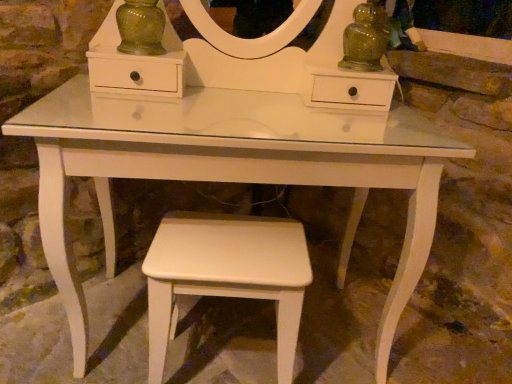
The image size is (512, 384). What do you see at coordinates (226, 274) in the screenshot? I see `white matte stool at lower center` at bounding box center [226, 274].

Measure the distance between point (283, 247) and camera.

The distance of point (283, 247) from camera is 1.08 meters.

Where is `white matte stool at lower center`? white matte stool at lower center is located at coordinates (226, 274).

Locate an element on the screen. green glass vase at upper left is located at coordinates (141, 28).

Describe the element at coordinates (141, 28) in the screenshot. The width and height of the screenshot is (512, 384). I see `green glass vase at upper left` at that location.

You are a GUI agent. You are given a task and a screenshot of the screen. Output one action in this format:
    pyautogui.click(x=<x>, y=<y>)
    Task: Click on the white matte stool at lower center
    
    Given the screenshot: What is the action you would take?
    pyautogui.click(x=226, y=274)

Between white matte stool at lower center and green glass vase at upper left, which one appears on the right side from the viewer's perspective?

white matte stool at lower center.

Does white matte stool at lower center come in front of green glass vase at upper left?

Yes, white matte stool at lower center is in front of green glass vase at upper left.

Does point (242, 250) come closer to viewer compared to point (126, 6)?

That is True.

From the image's perspective, between white matte stool at lower center and green glass vase at upper left, which one is located above?

green glass vase at upper left, from the image's perspective.

From a real-world perspective, is white matte stool at lower center above or below green glass vase at upper left?

From a real-world perspective, white matte stool at lower center is physically below green glass vase at upper left.

Does white matte stool at lower center have a greater width compared to green glass vase at upper left?

Yes.

Is white matte stool at lower center taller than green glass vase at upper left?

Yes, white matte stool at lower center is taller than green glass vase at upper left.

Looking at the image, does white matte stool at lower center seem bigger or smaller compared to green glass vase at upper left?

In the image, white matte stool at lower center appears to be larger than green glass vase at upper left.

Which is correct: white matte stool at lower center is inside green glass vase at upper left, or outside of it?

white matte stool at lower center is not enclosed by green glass vase at upper left.

Is white matte stool at lower center directly adjacent to green glass vase at upper left?

white matte stool at lower center and green glass vase at upper left are clearly separated.

Is white matte stool at lower center positioned with its back to green glass vase at upper left?

No, white matte stool at lower center is not facing away from green glass vase at upper left.

How many degrees apart are the facing directions of white matte stool at lower center and green glass vase at upper left?

white matte stool at lower center and green glass vase at upper left are facing 3.27 degrees away from each other.

In the image, there is a green glass vase at upper left. What are the coordinates of `stool below it (from a real-world perspective)` in the screenshot? It's located at (226, 274).

Which is more to the right, green glass vase at upper left or white matte stool at lower center?

white matte stool at lower center is more to the right.

Which object is further away from the camera, green glass vase at upper left or white matte stool at lower center?

green glass vase at upper left is further from the camera.

Considering the positions of point (159, 15) and point (294, 288), is point (159, 15) closer or farther from the camera than point (294, 288)?

Point (159, 15) is positioned farther from the camera compared to point (294, 288).

From the image's perspective, which object appears higher, green glass vase at upper left or white matte stool at lower center?

green glass vase at upper left, from the image's perspective.

From a real-world perspective, is green glass vase at upper left positioned over white matte stool at lower center based on gravity?

Yes, from a real-world perspective, green glass vase at upper left is above white matte stool at lower center.

Can you confirm if green glass vase at upper left is wider than white matte stool at lower center?

In fact, green glass vase at upper left might be narrower than white matte stool at lower center.

Is green glass vase at upper left taller or shorter than white matte stool at lower center?

Clearly, green glass vase at upper left is shorter compared to white matte stool at lower center.

Is green glass vase at upper left bigger or smaller than white matte stool at lower center?

In the image, green glass vase at upper left appears to be smaller than white matte stool at lower center.

Is green glass vase at upper left surrounding white matte stool at lower center?

No, white matte stool at lower center is not inside green glass vase at upper left.

In the scene shown: Is green glass vase at upper left not close to white matte stool at lower center?

green glass vase at upper left is actually quite close to white matte stool at lower center.

Is green glass vase at upper left aimed at white matte stool at lower center?

No, green glass vase at upper left is not aimed at white matte stool at lower center.

How many degrees apart are the facing directions of green glass vase at upper left and white matte stool at lower center?

There is a 3.27-degree angle between the facing directions of green glass vase at upper left and white matte stool at lower center.

Measure the distance from green glass vase at upper left to white matte stool at lower center.

green glass vase at upper left and white matte stool at lower center are 24.44 inches apart.

Locate an element on the screen. stool lying in front of the green glass vase at upper left is located at coordinates (226, 274).

Identify the location of stool that is on the right side of green glass vase at upper left. (226, 274).

The height and width of the screenshot is (384, 512). Identify the location of glass vase lying above the white matte stool at lower center (from the image's perspective). (141, 28).